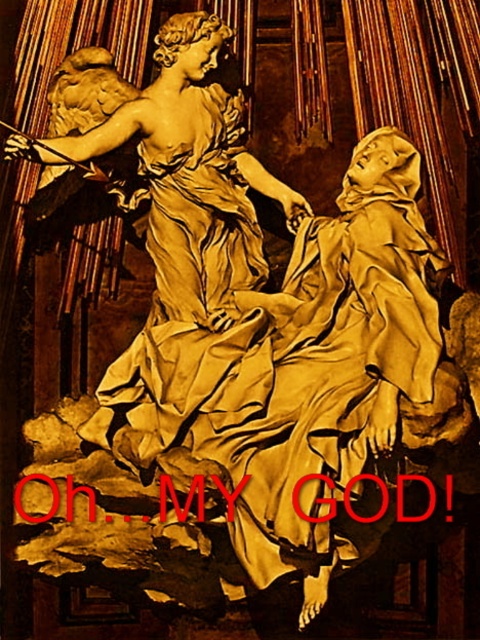
You are an art conservator tasked with moving the matte gold statue at upper center to the location of the matte gold robe at center. Given that the minimum safe distance for transporting such statues is 30 feet, is this move feasible?

The matte gold robe at center and matte gold statue at upper center are 34.17 feet apart from each other, which exceeds the minimum safe distance of 30 feet. Therefore, moving the matte gold statue at upper center to the location of the matte gold robe at center is feasible as the distance requirement is met.

You are an art conservator examining the sculpture. You notice the matte gold robe at center and the matte gold statue at upper center. Which object is closer to you in the composition?

The matte gold robe at center is closer to you because it is in front of the matte gold statue at upper center.

You are an art conservator examining the sculpture. You notice the matte gold robe at center and the matte gold statue at upper center. Which object is positioned lower in the image?

The matte gold robe at center is located below the matte gold statue at upper center, so it is positioned lower in the image.